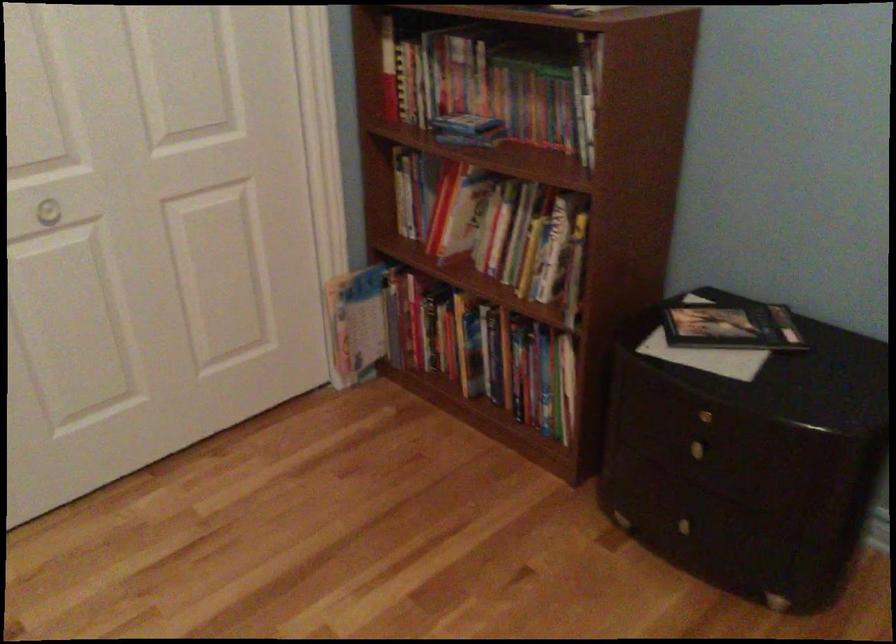
Where would you turn the white door knob? Please return your answer as a coordinate pair (x, y).

(47, 212)